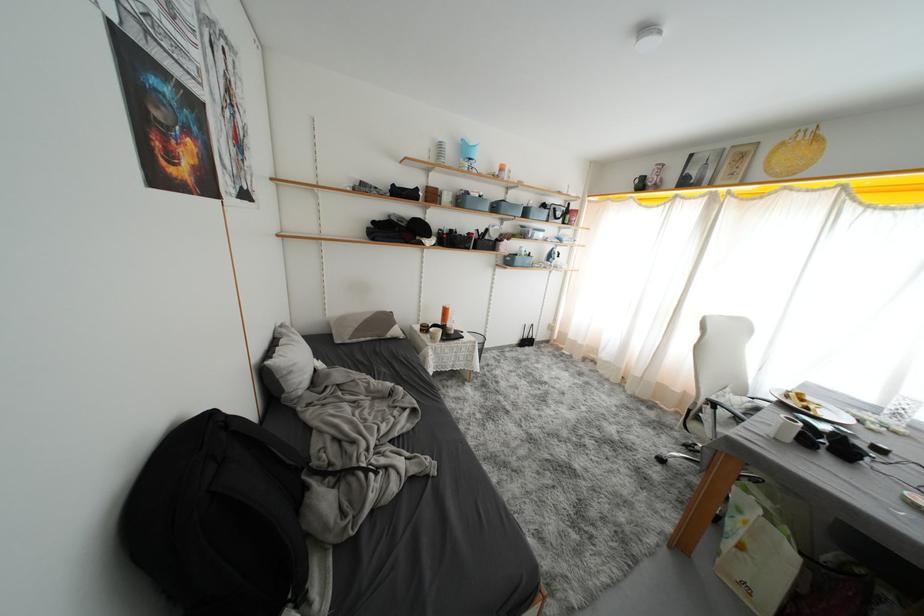
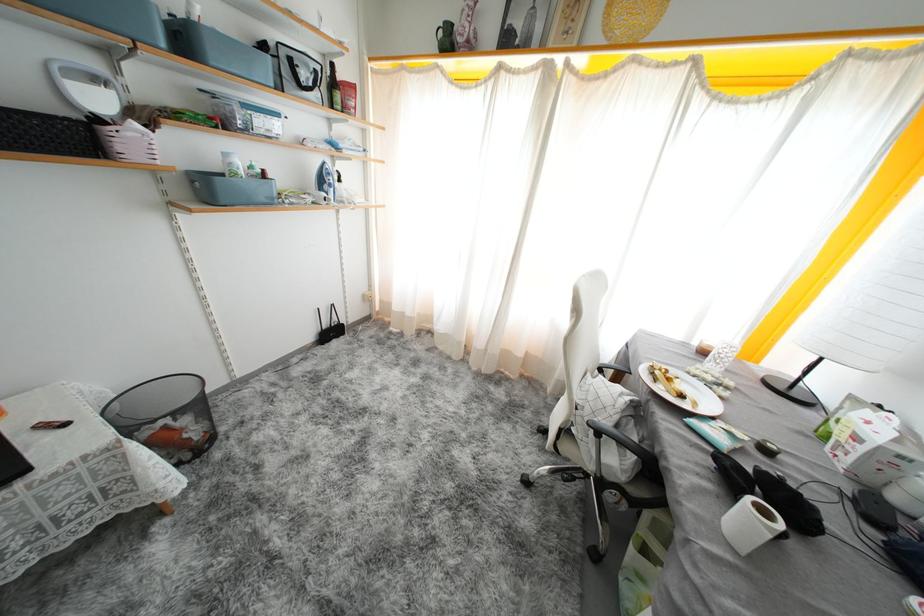
Find the pixel in the second image that matches (x=512, y=245) in the first image.

(141, 129)